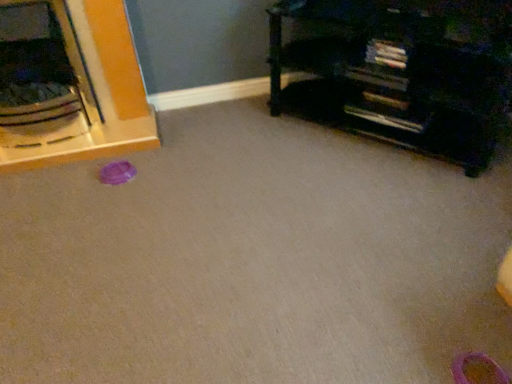
The height and width of the screenshot is (384, 512). Identify the location of vacant space in between brushed metal bowl at left, the second furniture viewed from the right, and black matte bookshelf at upper right, the 2th furniture when ordered from left to right. (216, 145).